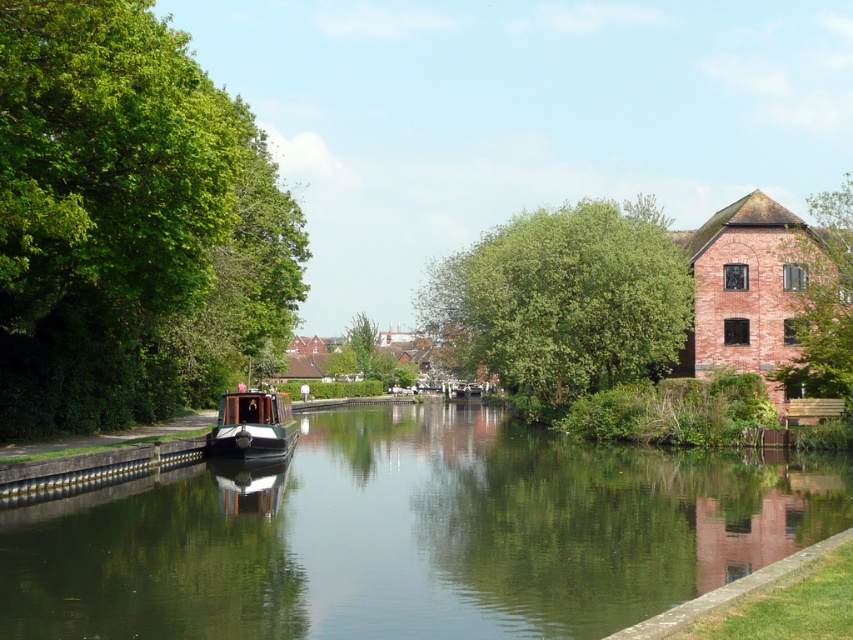
You are standing at the center of the canal and looking towards the left side. Which object is located at the coordinates point (129, 224)?

The point (129, 224) marks the green leafy tree at left.

You are standing at the center of the canal and want to locate the green leafy tree at left. Based on the coordinates provided, in which direction should you look to find it?

The green leafy tree at left is located at coordinates point (129,224), which means you should look to your left side to find it.

You are standing on the docked narrowboat and want to look at the green leafy tree at left and the green leafy tree at upper right. Which tree is positioned higher up in the scene?

The green leafy tree at upper right is positioned higher up in the scene compared to the green leafy tree at left, as it is located above it.